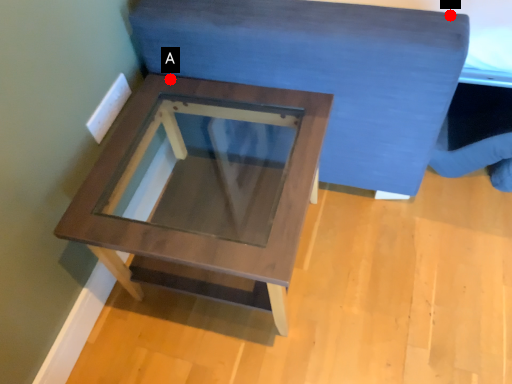
Question: Two points are circled on the image, labeled by A and B beside each circle. Which point appears closest to the camera in this image?

Choices:
 (A) A is closer
 (B) B is closer

Answer: (B)